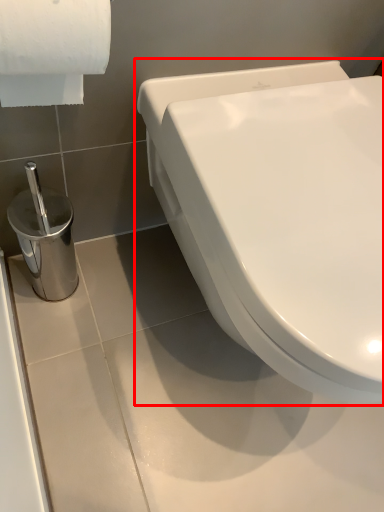
Question: Considering the relative positions of toilet (annotated by the red box) and toilet paper in the image provided, where is toilet (annotated by the red box) located with respect to the staircase?

Choices:
 (A) right
 (B) left

Answer: (A)